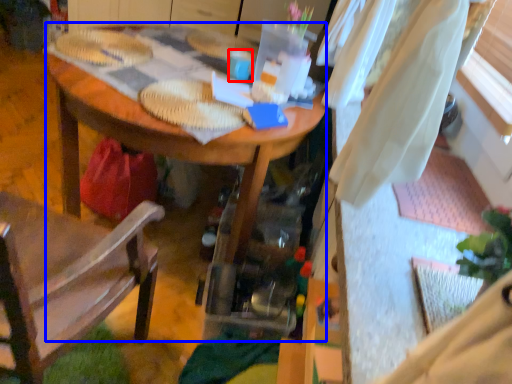
Question: Which point is closer to the camera, coffee cup (highlighted by a red box) or desk (highlighted by a blue box)?

Choices:
 (A) coffee cup
 (B) desk

Answer: (B)